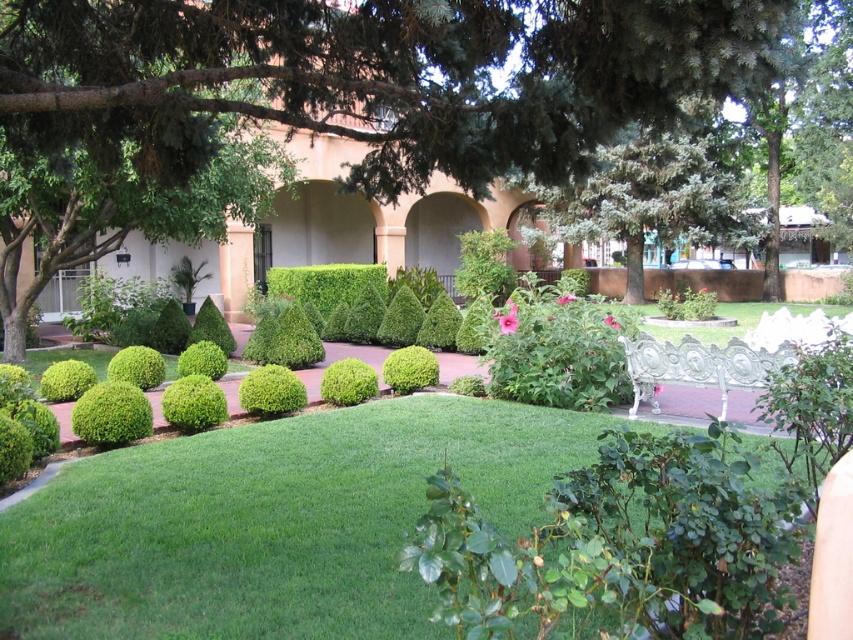
Question: Which of the following is the farthest from the observer?

Choices:
 (A) (138, 424)
 (B) (390, 132)

Answer: (A)

Question: Is green leafy tree at center bigger than green smooth grass at center?

Choices:
 (A) no
 (B) yes

Answer: (B)

Question: Is green leafy tree at center to the left of green smooth grass at center from the viewer's perspective?

Choices:
 (A) yes
 (B) no

Answer: (B)

Question: Among these points, which one is farthest from the camera?

Choices:
 (A) (120, 400)
 (B) (314, 92)

Answer: (A)

Question: Is green leafy tree at center smaller than green smooth grass at center?

Choices:
 (A) no
 (B) yes

Answer: (A)

Question: Among these points, which one is nearest to the camera?

Choices:
 (A) (376, 84)
 (B) (97, 433)
 (C) (334, 428)

Answer: (A)